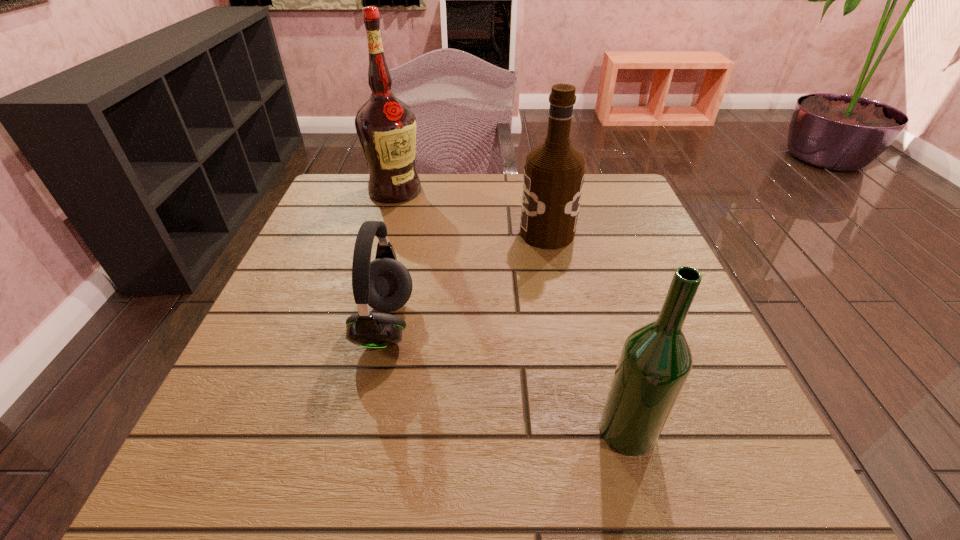
I want to click on the leftmost alcohol, so click(386, 127).

Locate an element on the screen. the tallest object is located at coordinates (386, 127).

This screenshot has height=540, width=960. I want to click on the second farthest alcohol, so click(x=554, y=172).

Identify the location of the nearest alcohol. (655, 362).

I want to click on the shortest object, so click(384, 284).

You are a GUI agent. You are given a task and a screenshot of the screen. Output one action in this format:
    pyautogui.click(x=<x>, y=<y>)
    Task: Click on the headset
    The height and width of the screenshot is (540, 960).
    Given the screenshot: What is the action you would take?
    pyautogui.click(x=384, y=284)

Image resolution: width=960 pixels, height=540 pixels. In order to click on blank space located on the label of the tallest alcohol in this screenshot , I will do `click(382, 235)`.

Locate an element on the screen. Image resolution: width=960 pixels, height=540 pixels. vacant region located on the label of the third nearest object is located at coordinates (357, 233).

Where is `vacant space located 0.170m on the label of the third nearest object`? The width and height of the screenshot is (960, 540). vacant space located 0.170m on the label of the third nearest object is located at coordinates (445, 233).

I want to click on free space located 0.090m on the label of the third nearest object, so click(x=481, y=233).